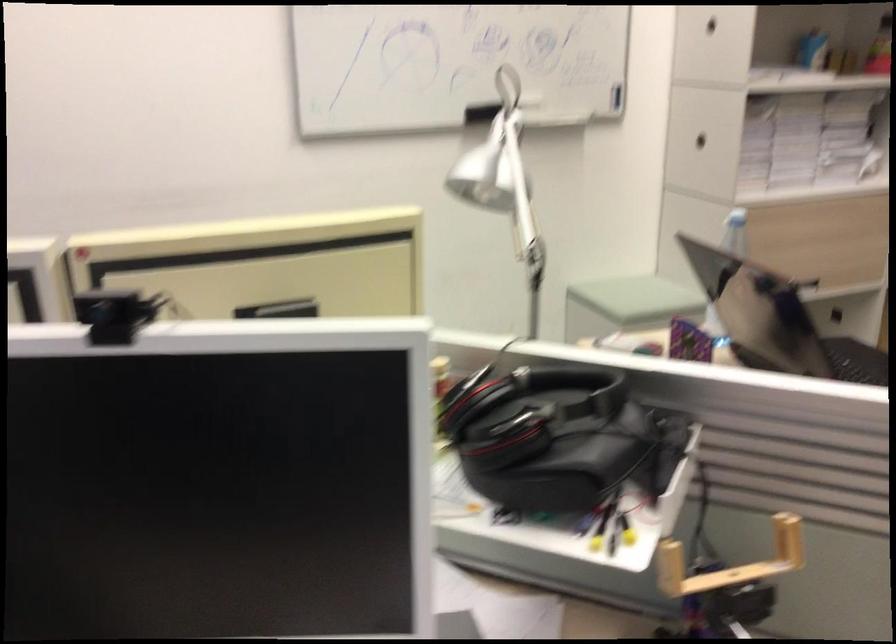
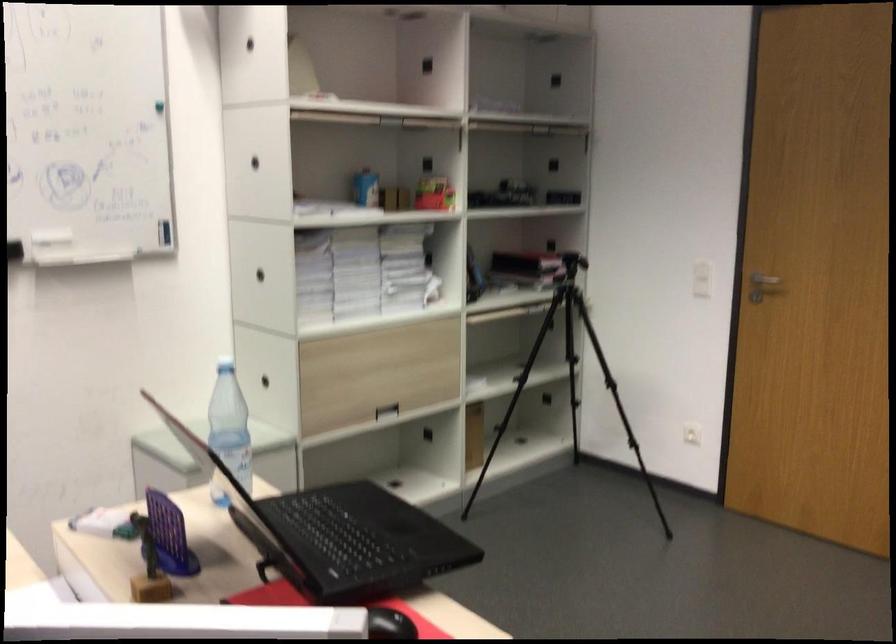
Question: How did the camera likely rotate?

Choices:
 (A) Left
 (B) Right
 (C) Up
 (D) Down

Answer: (B)